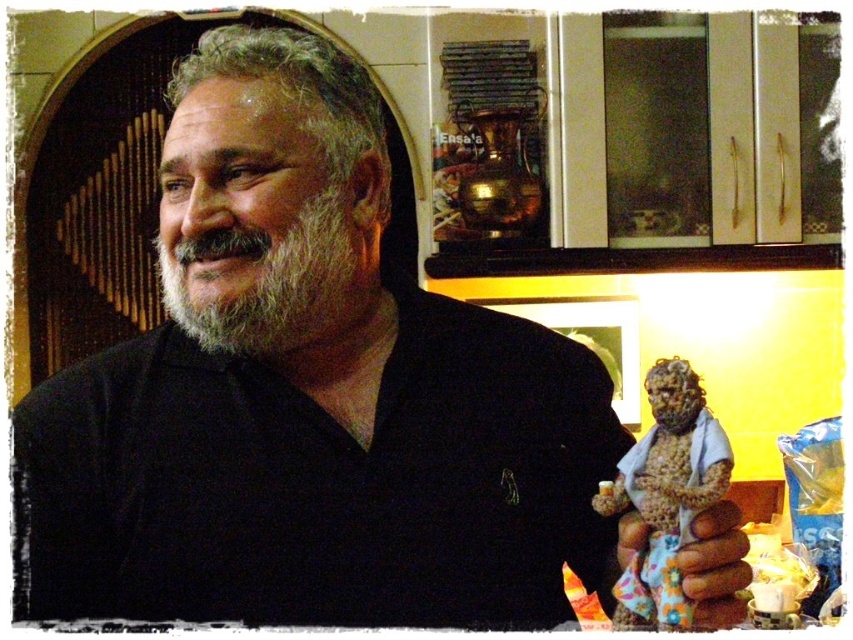
Based on the photo, you are an artist trying to sketch the man in the image. You notice the graywoollybeard at left and the brown textured hand at lower right. Which object is positioned more to the left side of the image?

The graywoollybeard at left is positioned more to the left side of the image than the brown textured hand at lower right.